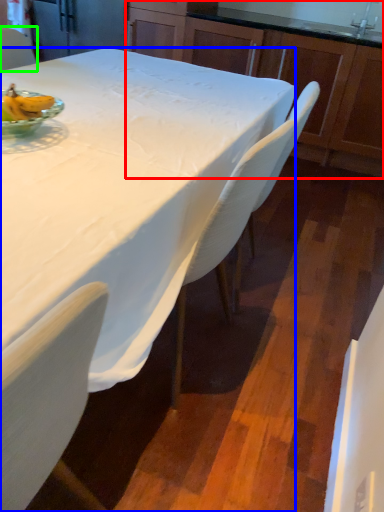
Question: Based on their relative distances, which object is farther from cabinetry (highlighted by a red box)? Choose from desk (highlighted by a blue box) and chair (highlighted by a green box).

Choices:
 (A) desk
 (B) chair

Answer: (A)